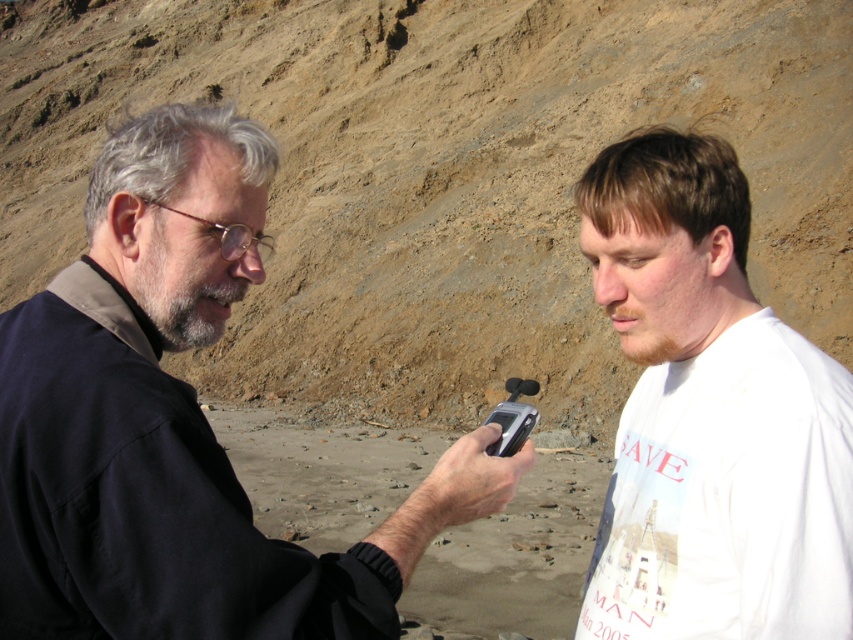
Does point (45, 634) come behind point (676, 600)?

No, (45, 634) is closer to viewer.

Is matte black jacket at left shorter than white cotton t-shirt at right?

Yes, matte black jacket at left is shorter than white cotton t-shirt at right.

The height and width of the screenshot is (640, 853). Find the location of `matte black jacket at left`. matte black jacket at left is located at coordinates point(177,422).